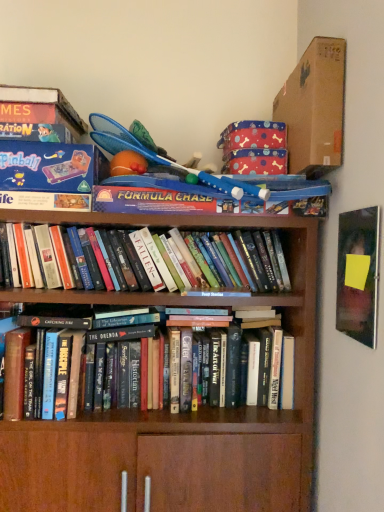
Question: Is matte black book at upper right taller or shorter than brown cardboard box at upper right?

Choices:
 (A) short
 (B) tall

Answer: (A)

Question: From the image's perspective, is matte black book at upper right above or below brown cardboard box at upper right?

Choices:
 (A) above
 (B) below

Answer: (B)

Question: Which object is positioned closest to the brown cardboard box at upper right?

Choices:
 (A) hardcover books at center, the 1th book ordered from the bottom
 (B) matte black book at upper right
 (C) blue plastic toy at upper center
 (D) hardcover books at center, which ranks as the 1th book in top-to-bottom order

Answer: (C)

Question: Which object is positioned closest to the blue plastic toy at upper center?

Choices:
 (A) hardcover books at center, the 1th book ordered from the bottom
 (B) hardcover books at center, placed as the 2th book when sorted from bottom to top
 (C) brown cardboard box at upper right
 (D) matte black book at upper right

Answer: (B)